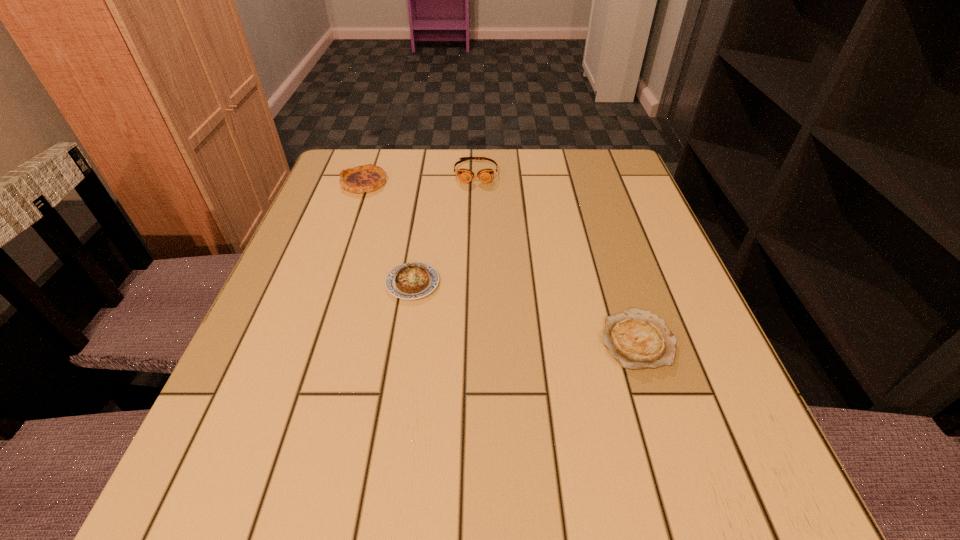
Image resolution: width=960 pixels, height=540 pixels. Find the location of `vacant space that is in between the tallest quiche and the second object from right to left`. vacant space that is in between the tallest quiche and the second object from right to left is located at coordinates (420, 177).

Where is `empty location between the second object from left to right and the rightmost quiche`? The width and height of the screenshot is (960, 540). empty location between the second object from left to right and the rightmost quiche is located at coordinates (524, 311).

Where is `vacant area that lies between the second object from right to left and the nearest object`? The width and height of the screenshot is (960, 540). vacant area that lies between the second object from right to left and the nearest object is located at coordinates (556, 255).

Identify which object is the closest to the goggles. Please provide its 2D coordinates. Your answer should be formatted as a tuple, i.e. [(x, y)], where the tuple contains the x and y coordinates of a point satisfying the conditions above.

[(366, 178)]

Identify the location of object that is the third closest to the nearest quiche. Image resolution: width=960 pixels, height=540 pixels. (366, 178).

At what (x,y) coordinates should I click in order to perform the action: click on quiche that is the closest to the nearest quiche. Please return your answer as a coordinate pair (x, y). This screenshot has width=960, height=540. Looking at the image, I should click on (414, 280).

Identify which quiche is the closest to the second quiche from left to right. Please provide its 2D coordinates. Your answer should be formatted as a tuple, i.e. [(x, y)], where the tuple contains the x and y coordinates of a point satisfying the conditions above.

[(366, 178)]

Find the location of a particular element. This screenshot has width=960, height=540. blank space that satisfies the following two spatial constraints: 1. with the lenses facing forward on the rightmost object; 2. on the right side of the tallest object is located at coordinates (474, 339).

Where is `free space that satisfies the following two spatial constraints: 1. on the front side of the leftmost quiche; 2. on the left side of the second quiche from left to right`? This screenshot has height=540, width=960. free space that satisfies the following two spatial constraints: 1. on the front side of the leftmost quiche; 2. on the left side of the second quiche from left to right is located at coordinates (328, 283).

Find the location of a particular element. This screenshot has width=960, height=540. free location that satisfies the following two spatial constraints: 1. with the lenses facing forward on the goggles; 2. on the left side of the rightmost quiche is located at coordinates (474, 339).